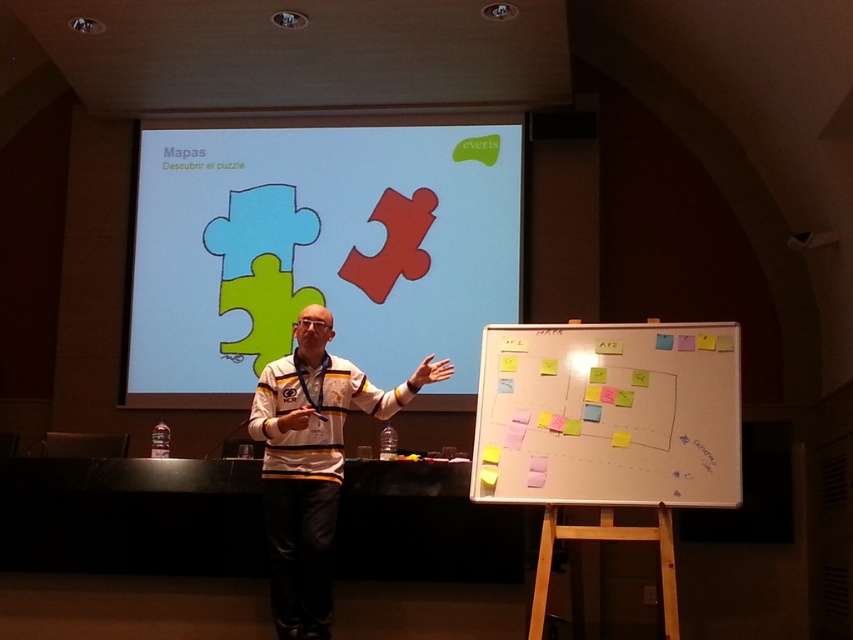
Who is shorter, matte plastic puzzle pieces at center or whiteboard paper at center?

Standing shorter between the two is whiteboard paper at center.

Is the position of matte plastic puzzle pieces at center more distant than that of whiteboard paper at center?

Yes, it is.

Locate an element on the screen. matte plastic puzzle pieces at center is located at coordinates (318, 252).

Is point (154, 324) positioned in front of point (299, 600)?

No.

In the scene shown: Is matte plastic puzzle pieces at center to the right of white jersey at center from the viewer's perspective?

Incorrect, matte plastic puzzle pieces at center is not on the right side of white jersey at center.

Between point (137, 282) and point (294, 528), which one is positioned behind?

The point (137, 282) is more distant.

At what (x,y) coordinates should I click in order to perform the action: click on matte plastic puzzle pieces at center. Please return your answer as a coordinate pair (x, y). The image size is (853, 640). Looking at the image, I should click on (318, 252).

Which is behind, point (740, 432) or point (267, 513)?

Point (267, 513)

Does whiteboard paper at center appear on the right side of white jersey at center?

Correct, you'll find whiteboard paper at center to the right of white jersey at center.

Which is behind, point (675, 397) or point (265, 460)?

The point (265, 460) is more distant.

The image size is (853, 640). Find the location of `whiteboard paper at center`. whiteboard paper at center is located at coordinates (608, 413).